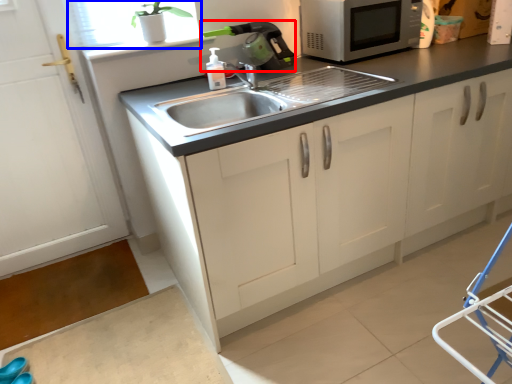
Question: Among these objects, which one is farthest to the camera, appliance (highlighted by a red box) or window screen (highlighted by a blue box)?

Choices:
 (A) appliance
 (B) window screen

Answer: (A)